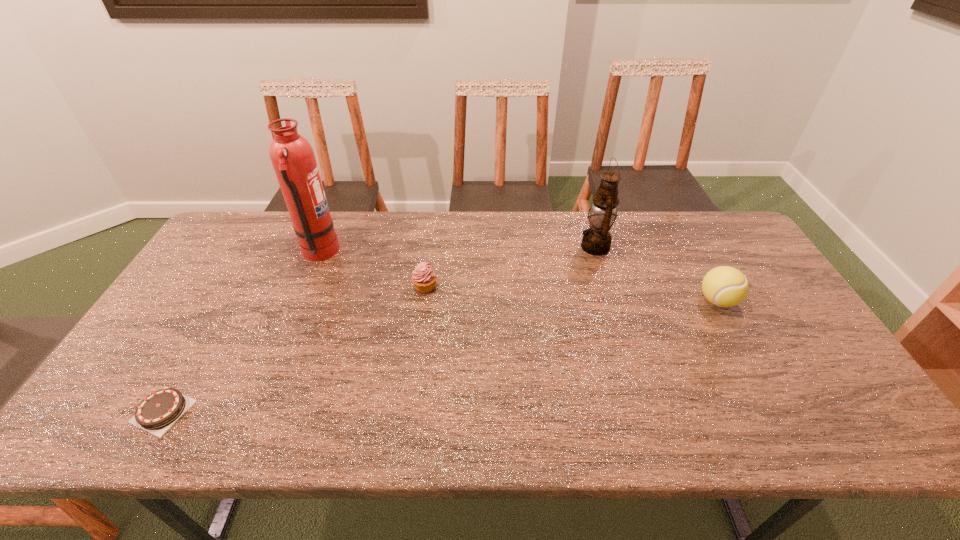
The image size is (960, 540). What are the coordinates of `the tallest object` in the screenshot? It's located at (293, 159).

Where is `fire extinguisher`? fire extinguisher is located at coordinates (293, 159).

Where is `the second object from right to left`? This screenshot has height=540, width=960. the second object from right to left is located at coordinates click(596, 240).

Identify the location of oil lamp. (596, 240).

I want to click on tennis ball, so pyautogui.click(x=724, y=286).

Where is `the rightmost object`? The image size is (960, 540). the rightmost object is located at coordinates (724, 286).

Find the location of a particular element. cupcake is located at coordinates (424, 278).

You are a GUI agent. You are given a task and a screenshot of the screen. Output one action in this format:
    pyautogui.click(x=<x>, y=<y>)
    Task: Click on the third object from right to left
    The image size is (960, 540).
    Given the screenshot: What is the action you would take?
    pyautogui.click(x=424, y=278)

What are the coordinates of `the nearest object` in the screenshot? It's located at (156, 413).

You are a GUI agent. You are given a task and a screenshot of the screen. Output one action in this format:
    pyautogui.click(x=<x>, y=<y>)
    Task: Click on the shortest object
    
    Given the screenshot: What is the action you would take?
    pyautogui.click(x=156, y=413)